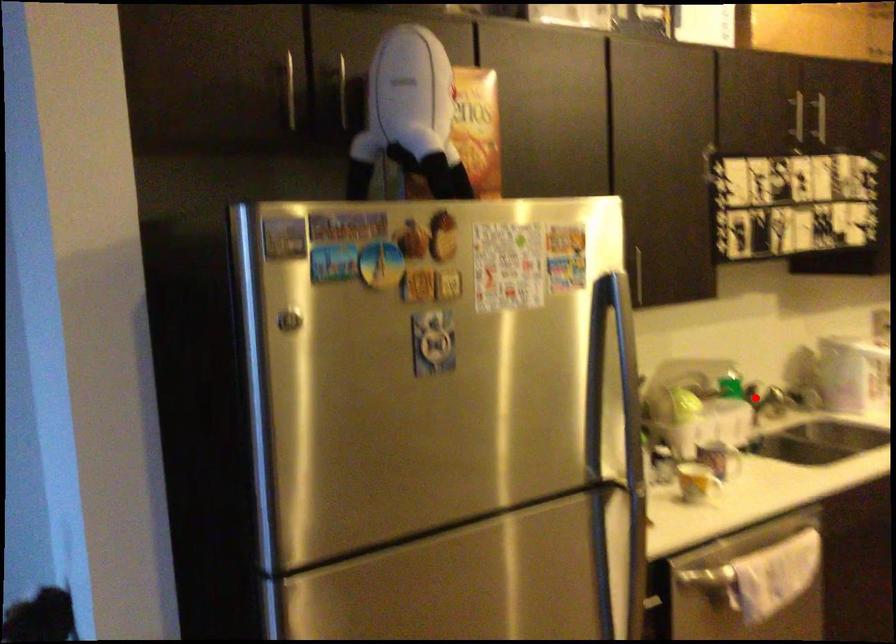
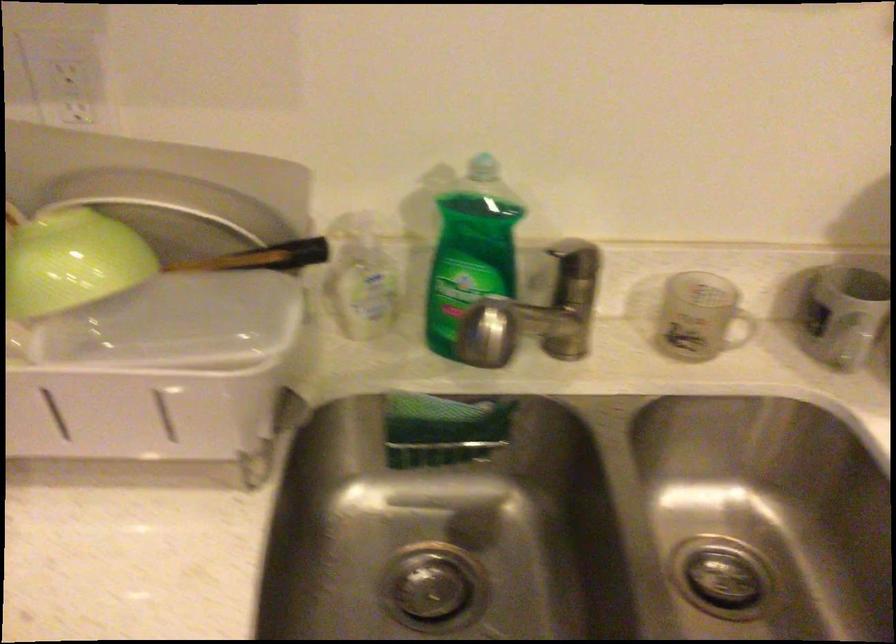
Question: I am providing you with two images of the same scene from different viewpoints. In image1, a red point is highlighted. Considering the same 3D point in image2, which of the following is correct?

Choices:
 (A) It is closer
 (B) It is farther

Answer: (A)